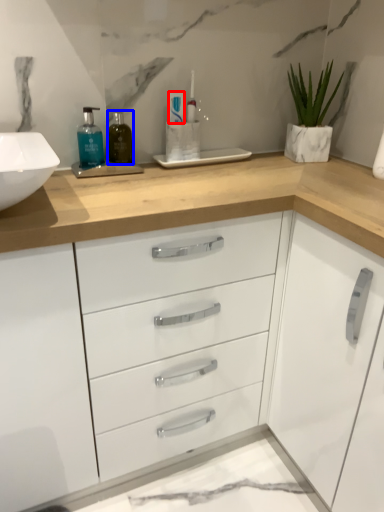
Question: Which of the following is the closest to the observer, toothpaste (highlighted by a red box) or mouthwash (highlighted by a blue box)?

Choices:
 (A) toothpaste
 (B) mouthwash

Answer: (B)